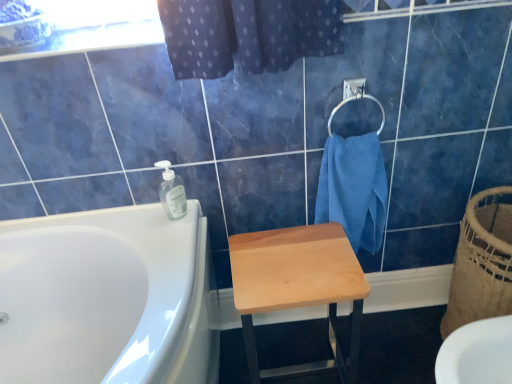
Question: From a real-world perspective, does clear plastic soap dispenser at upper center stand above blue cotton towel at upper right?

Choices:
 (A) no
 (B) yes

Answer: (B)

Question: Can you confirm if clear plastic soap dispenser at upper center is taller than blue cotton towel at upper right?

Choices:
 (A) yes
 (B) no

Answer: (B)

Question: Would you say clear plastic soap dispenser at upper center contains blue cotton towel at upper right?

Choices:
 (A) no
 (B) yes

Answer: (A)

Question: From a real-world perspective, is clear plastic soap dispenser at upper center physically below blue cotton towel at upper right?

Choices:
 (A) no
 (B) yes

Answer: (A)

Question: Is clear plastic soap dispenser at upper center positioned with its back to blue cotton towel at upper right?

Choices:
 (A) yes
 (B) no

Answer: (B)

Question: Is clear plastic soap dispenser at upper center wider than blue cotton towel at upper right?

Choices:
 (A) yes
 (B) no

Answer: (B)

Question: Is the depth of clear plastic soap dispenser at upper center greater than that of natural woven basket at right?

Choices:
 (A) yes
 (B) no

Answer: (A)

Question: Is clear plastic soap dispenser at upper center at the right side of natural woven basket at right?

Choices:
 (A) yes
 (B) no

Answer: (B)

Question: Considering the relative sizes of clear plastic soap dispenser at upper center and natural woven basket at right in the image provided, is clear plastic soap dispenser at upper center taller than natural woven basket at right?

Choices:
 (A) no
 (B) yes

Answer: (A)

Question: Can you confirm if clear plastic soap dispenser at upper center is wider than natural woven basket at right?

Choices:
 (A) no
 (B) yes

Answer: (A)

Question: From the image's perspective, would you say clear plastic soap dispenser at upper center is positioned over natural woven basket at right?

Choices:
 (A) no
 (B) yes

Answer: (B)

Question: Is natural woven basket at right surrounded by clear plastic soap dispenser at upper center?

Choices:
 (A) no
 (B) yes

Answer: (A)

Question: Is clear plastic soap dispenser at upper center not close to silver metallic towel bar at upper right?

Choices:
 (A) yes
 (B) no

Answer: (B)